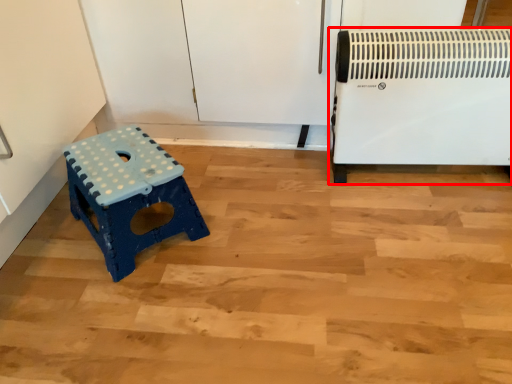
Question: From the image's perspective, what is the correct spatial positioning of home appliance (annotated by the red box) in reference to furniture?

Choices:
 (A) below
 (B) above

Answer: (B)